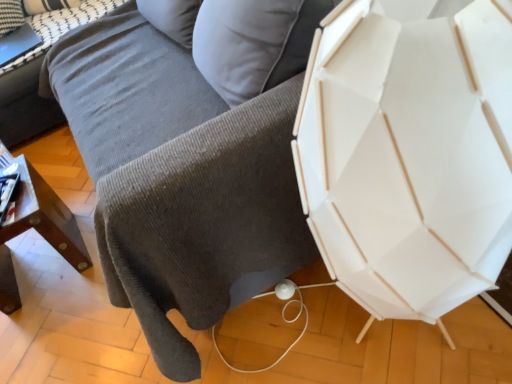
Describe the element at coordinates (182, 173) in the screenshot. This screenshot has height=384, width=512. I see `gray corduroy couch at center` at that location.

Measure the distance between gray corduroy couch at upper left and camera.

gray corduroy couch at upper left is 2.04 meters from camera.

I want to click on gray corduroy couch at center, so click(x=182, y=173).

Is white textured pillow at upper left spatially inside gray corduroy couch at upper left, or outside of it?

white textured pillow at upper left lies within the bounds of gray corduroy couch at upper left.

How different are the orientations of white textured pillow at upper left and gray corduroy couch at upper left in degrees?

32.7 degrees.

Is white textured pillow at upper left facing towards gray corduroy couch at upper left?

Yes, white textured pillow at upper left is aimed at gray corduroy couch at upper left.

Is white textured pillow at upper left wider than gray corduroy couch at upper left?

No.

Is wooden table at lower left oriented towards gray corduroy couch at center?

Yes, wooden table at lower left faces towards gray corduroy couch at center.

What's the angular difference between wooden table at lower left and gray corduroy couch at center's facing directions?

1.83 degrees.

From the picture: Based on their sizes in the image, would you say wooden table at lower left is bigger or smaller than gray corduroy couch at center?

wooden table at lower left is smaller than gray corduroy couch at center.

Is wooden table at lower left inside or outside of gray corduroy couch at center?

A: wooden table at lower left is inside gray corduroy couch at center.

From the image's perspective, which one is positioned higher, gray corduroy couch at center or white textured pillow at upper left?

From the image's view, white textured pillow at upper left is above.

Between gray corduroy couch at center and white textured pillow at upper left, which one has larger width?

Wider between the two is gray corduroy couch at center.

Considering the positions of objects gray corduroy couch at center and white textured pillow at upper left in the image provided, who is more to the right, gray corduroy couch at center or white textured pillow at upper left?

Positioned to the right is gray corduroy couch at center.

Choose the correct answer: Is wooden table at lower left inside gray corduroy couch at upper left or outside it?

wooden table at lower left is not enclosed by gray corduroy couch at upper left.

Is wooden table at lower left beside gray corduroy couch at upper left?

No, wooden table at lower left is not touching gray corduroy couch at upper left.

Which of these two, wooden table at lower left or gray corduroy couch at upper left, stands shorter?

With less height is gray corduroy couch at upper left.

Is wooden table at lower left oriented away from gray corduroy couch at upper left?

wooden table at lower left is not turned away from gray corduroy couch at upper left.

Which of these two, gray corduroy couch at upper left or white textured pillow at upper left, is bigger?

gray corduroy couch at upper left is bigger.

Which object is wider, gray corduroy couch at upper left or white textured pillow at upper left?

gray corduroy couch at upper left.

Consider the image. How many degrees apart are the facing directions of gray corduroy couch at upper left and white textured pillow at upper left?

32.7 degrees.

Does gray corduroy couch at upper left have a lesser height compared to white textured pillow at upper left?

Yes, gray corduroy couch at upper left is shorter than white textured pillow at upper left.

Looking at this image, from the image's perspective, is gray corduroy couch at center on gray corduroy couch at upper left?

No.

Is gray corduroy couch at center located outside gray corduroy couch at upper left?

Absolutely, gray corduroy couch at center is external to gray corduroy couch at upper left.

Consider the image. Which of these two, gray corduroy couch at center or gray corduroy couch at upper left, is smaller?

Smaller between the two is gray corduroy couch at upper left.

Which of these two, gray corduroy couch at center or wooden table at lower left, stands shorter?

With less height is wooden table at lower left.

Is gray corduroy couch at center positioned far away from wooden table at lower left?

No, there isn't a large distance between gray corduroy couch at center and wooden table at lower left.

Would you say wooden table at lower left is part of gray corduroy couch at center's contents?

Yes, wooden table at lower left is surrounded by gray corduroy couch at center.

What are the coordinates of `table on the right of the white textured pillow at upper left` in the screenshot? It's located at (26, 103).

You are a GUI agent. You are given a task and a screenshot of the screen. Output one action in this format:
    pyautogui.click(x=<x>, y=<y>)
    Task: Click on the furniture on the left of gray corduroy couch at center
    
    Given the screenshot: What is the action you would take?
    pyautogui.click(x=37, y=229)

Looking at the image, which one is located closer to white textured pillow at upper left, gray corduroy couch at upper left or gray corduroy couch at center?

Based on the image, gray corduroy couch at upper left appears to be nearer to white textured pillow at upper left.

Based on their spatial positions, is wooden table at lower left or gray corduroy couch at upper left further from white textured pillow at upper left?

wooden table at lower left lies further to white textured pillow at upper left than the other object.

Looking at this image, which object lies nearer to the anchor point wooden table at lower left, gray corduroy couch at center or white textured pillow at upper left?

gray corduroy couch at center is closer to wooden table at lower left.

Which object lies further to the anchor point gray corduroy couch at upper left, gray corduroy couch at center or wooden table at lower left?

Among the two, wooden table at lower left is located further to gray corduroy couch at upper left.

When comparing their distances from gray corduroy couch at center, does gray corduroy couch at upper left or wooden table at lower left seem further?

gray corduroy couch at upper left lies further to gray corduroy couch at center than the other object.

Consider the image. Estimate the real-world distances between objects in this image. Which object is closer to gray corduroy couch at center, wooden table at lower left or gray corduroy couch at upper left?

The object closer to gray corduroy couch at center is wooden table at lower left.

Looking at the image, which one is located closer to gray corduroy couch at upper left, wooden table at lower left or gray corduroy couch at center?

gray corduroy couch at center is positioned closer to the anchor gray corduroy couch at upper left.

Looking at the image, which one is located further to wooden table at lower left, white textured pillow at upper left or gray corduroy couch at upper left?

white textured pillow at upper left is positioned further to the anchor wooden table at lower left.

The width and height of the screenshot is (512, 384). I want to click on furniture between gray corduroy couch at center and white textured pillow at upper left from front to back, so click(37, 229).

The height and width of the screenshot is (384, 512). Find the location of `furniture located between gray corduroy couch at center and gray corduroy couch at upper left in the depth direction`. furniture located between gray corduroy couch at center and gray corduroy couch at upper left in the depth direction is located at coordinates (37, 229).

The width and height of the screenshot is (512, 384). Identify the location of table positioned between gray corduroy couch at center and white textured pillow at upper left from near to far. (26, 103).

Image resolution: width=512 pixels, height=384 pixels. Identify the location of table between white textured pillow at upper left and wooden table at lower left in the up-down direction. (26, 103).